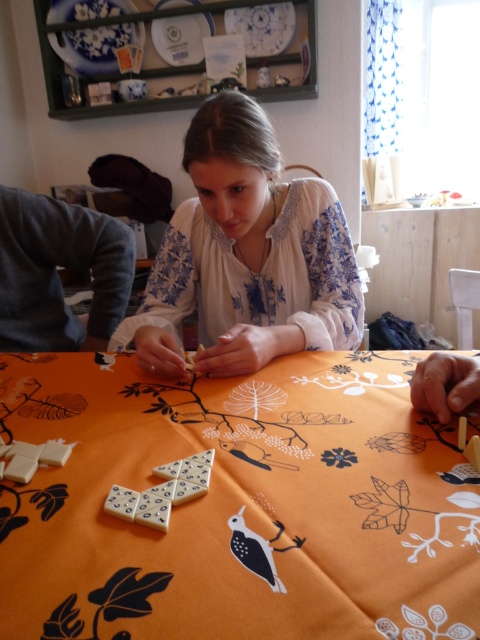
Can you confirm if gray sweater at left is bigger than smooth wooden hand at lower right?

Yes, gray sweater at left is bigger than smooth wooden hand at lower right.

Does gray sweater at left have a greater width compared to smooth wooden hand at lower right?

Yes, gray sweater at left is wider than smooth wooden hand at lower right.

Is point (60, 285) behind point (422, 365)?

Yes, it is.

Find the location of a particular element. gray sweater at left is located at coordinates (56, 272).

Is point (264, 225) farther from viewer compared to point (156, 524)?

Yes, it is.

Does point (296, 234) come farther from viewer compared to point (144, 515)?

That is True.

This screenshot has height=640, width=480. Find the location of `white embroidered blouse at center`. white embroidered blouse at center is located at coordinates (247, 256).

Is point (49, 323) positioned before point (189, 465)?

No, (49, 323) is behind (189, 465).

Who is higher up, gray sweater at left or white matte dominoes at center?

gray sweater at left is higher up.

This screenshot has width=480, height=640. What are the coordinates of `gray sweater at left` in the screenshot? It's located at (56, 272).